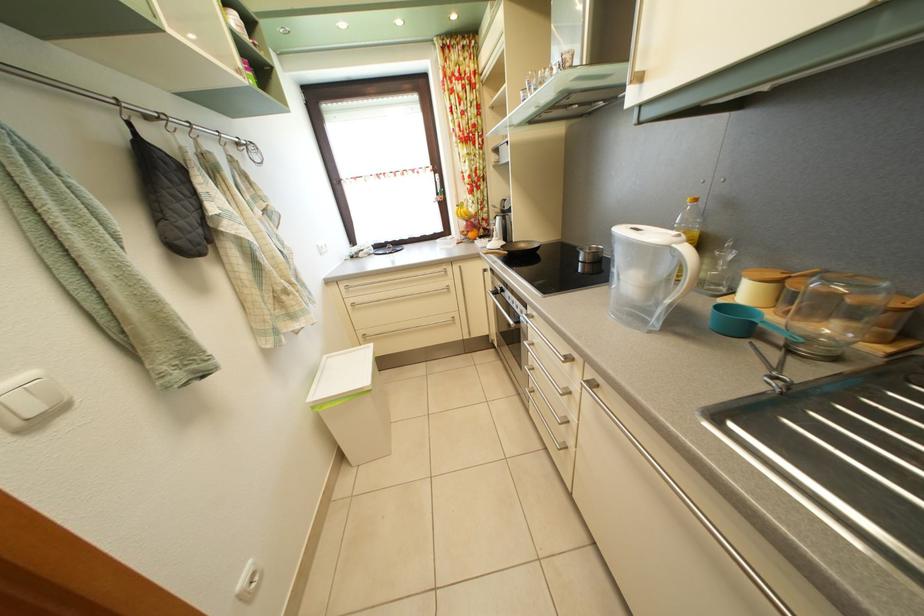
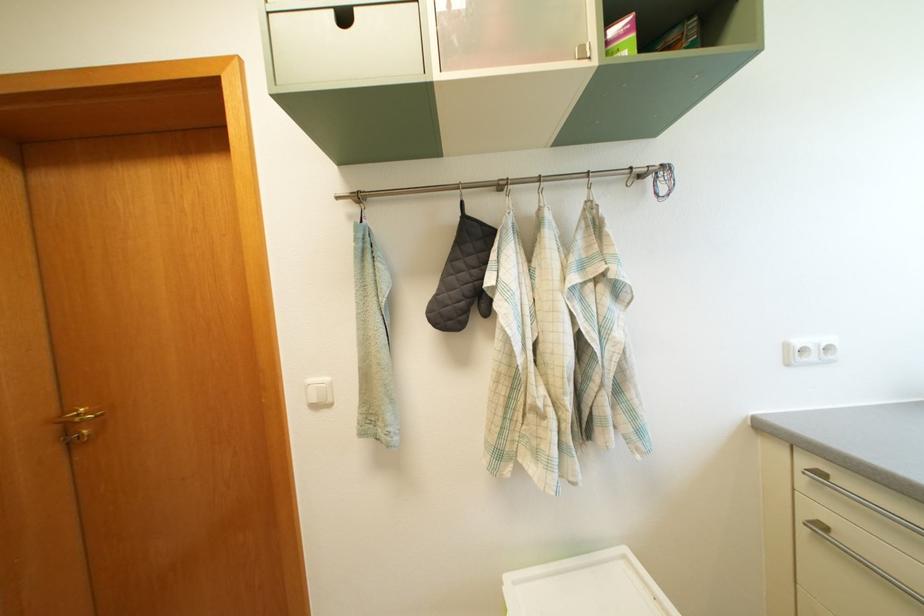
Where in the second image is the point corresponding to point (260, 155) from the first image?

(669, 180)